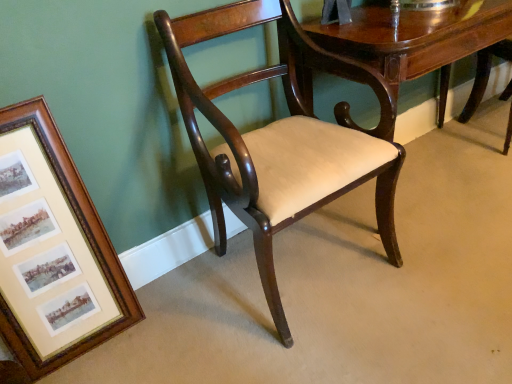
Locate an element on the screen. This screenshot has height=384, width=512. vacant space in front of mahogany wood table at center is located at coordinates (441, 269).